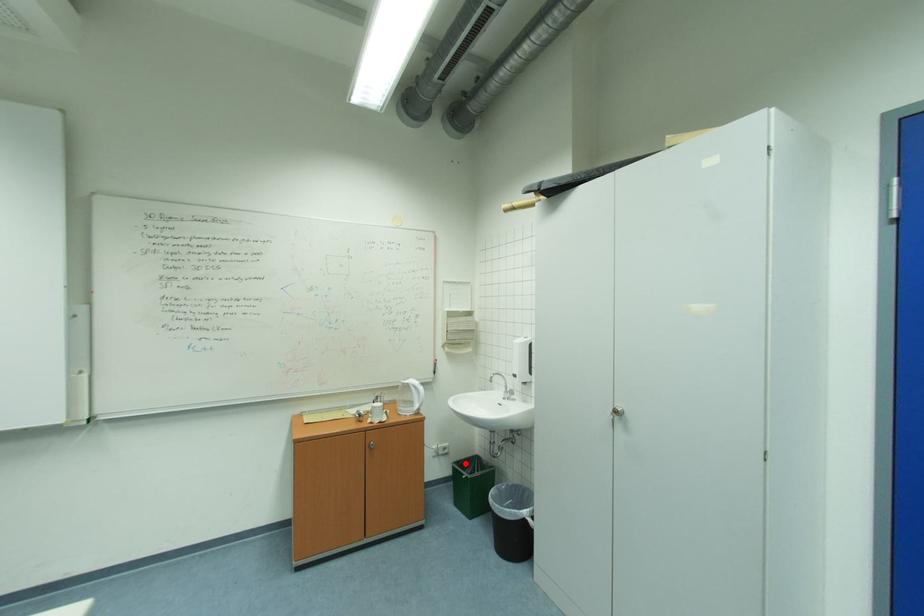
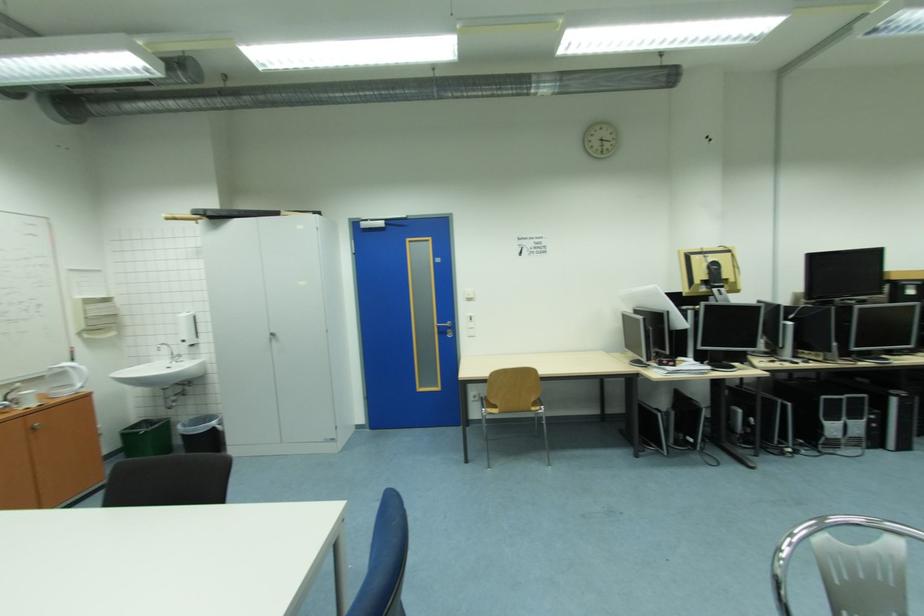
Question: I am providing you with two images of the same scene from different viewpoints. Given a red point in image1, look at the same physical point in image2. Is it:

Choices:
 (A) Closer to the viewpoint
 (B) Farther from the viewpoint

Answer: (A)